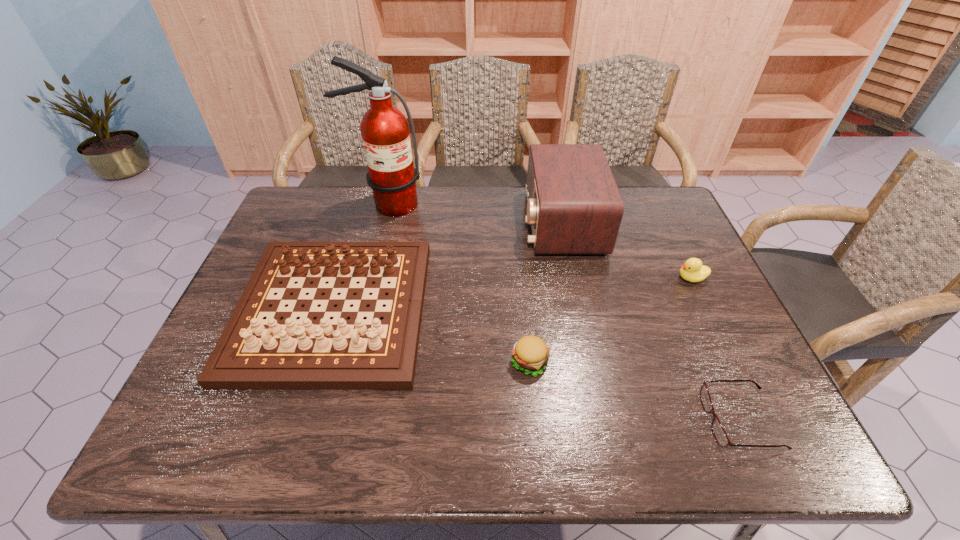
This screenshot has height=540, width=960. Identify the location of unoccupied area between the hamburger and the gameboard. (432, 336).

The image size is (960, 540). I want to click on object that is the third closest to the fourth shortest object, so click(x=574, y=206).

Select which object appears as the fifth closest to the duckling. Please provide its 2D coordinates. Your answer should be formatted as a tuple, i.e. [(x, y)], where the tuple contains the x and y coordinates of a point satisfying the conditions above.

[(385, 133)]

You are a GUI agent. You are given a task and a screenshot of the screen. Output one action in this format:
    pyautogui.click(x=<x>, y=<y>)
    Task: Click on the vacant area in the image that satisfies the following two spatial constraints: 1. on the nozzle and handle of the fire extinguisher; 2. on the left side of the hamburger
    The image size is (960, 540).
    Given the screenshot: What is the action you would take?
    pyautogui.click(x=348, y=362)

Where is `free point that satisfies the following two spatial constraints: 1. on the nozzle and handle of the hamburger; 2. on the left side of the tallest object`? free point that satisfies the following two spatial constraints: 1. on the nozzle and handle of the hamburger; 2. on the left side of the tallest object is located at coordinates (348, 362).

Locate an element on the screen. free point that satisfies the following two spatial constraints: 1. on the beak of the duckling; 2. on the side with the white pieces of the gameboard is located at coordinates (707, 310).

Where is `vacant region that satisfies the following two spatial constraints: 1. on the side with the white pieces of the hamburger; 2. on the left side of the gameboard`? The width and height of the screenshot is (960, 540). vacant region that satisfies the following two spatial constraints: 1. on the side with the white pieces of the hamburger; 2. on the left side of the gameboard is located at coordinates (317, 362).

Identify the location of free region that satisfies the following two spatial constraints: 1. on the nozzle and handle of the hamburger; 2. on the right side of the fire extinguisher. tap(348, 362).